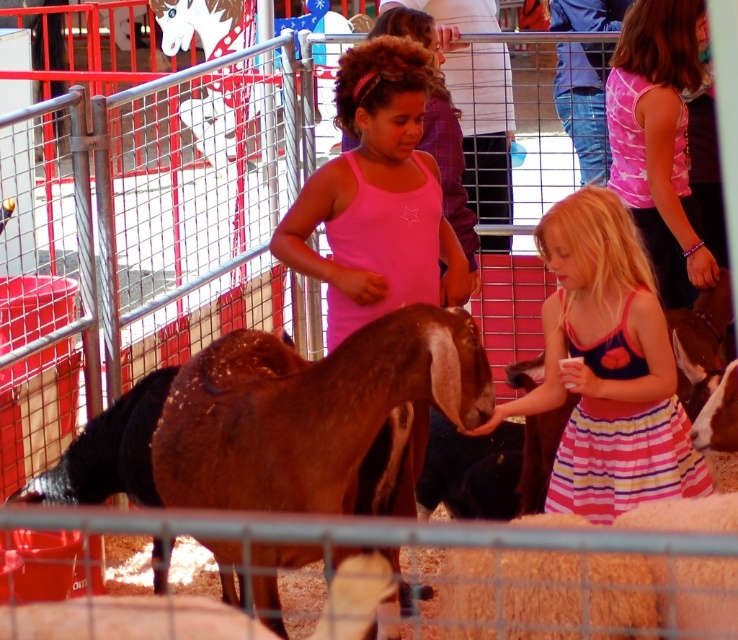
Question: Which of these objects is positioned closest to the brown woolen sheep at center?

Choices:
 (A) pink fabric tank top at center
 (B) fuzzy orange sheep at lower center

Answer: (B)

Question: Among these points, which one is farthest from the camera?

Choices:
 (A) (213, 436)
 (B) (559, 269)
 (C) (728, 502)

Answer: (B)

Question: Is striped cotton dress at lower right wider than pink fabric tank top at center?

Choices:
 (A) yes
 (B) no

Answer: (A)

Question: From the image, what is the correct spatial relationship of brown glossy goat at center in relation to pink fabric tank top at center?

Choices:
 (A) below
 (B) above

Answer: (A)

Question: Among these points, which one is farthest from the camera?

Choices:
 (A) (289, 420)
 (B) (372, 76)
 (C) (568, 342)
 (D) (720, 632)

Answer: (C)

Question: Observing the image, what is the correct spatial positioning of brown glossy goat at center in reference to pink fabric tank top at center?

Choices:
 (A) right
 (B) left

Answer: (B)